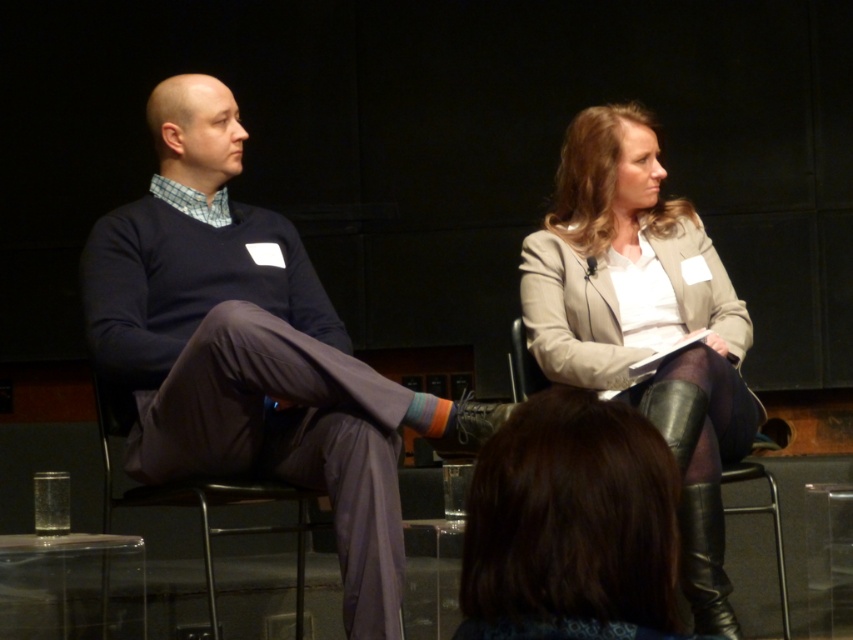
Question: Considering the real-world distances, which object is farthest from the dark blue sweater at left?

Choices:
 (A) beige leather jacket at upper right
 (B) leather boots at lower right

Answer: (B)

Question: Among these objects, which one is farthest from the camera?

Choices:
 (A) dark blue sweater at left
 (B) leather boots at lower right

Answer: (A)

Question: Is leather boots at lower right wider than metallic gray chair at center?

Choices:
 (A) no
 (B) yes

Answer: (A)

Question: Does dark blue sweater at left have a larger size compared to leather boots at lower right?

Choices:
 (A) yes
 (B) no

Answer: (A)

Question: Does dark blue sweater at left appear over leather boots at lower right?

Choices:
 (A) yes
 (B) no

Answer: (A)

Question: Which point appears farthest from the camera in this image?

Choices:
 (A) (207, 294)
 (B) (614, 396)

Answer: (B)